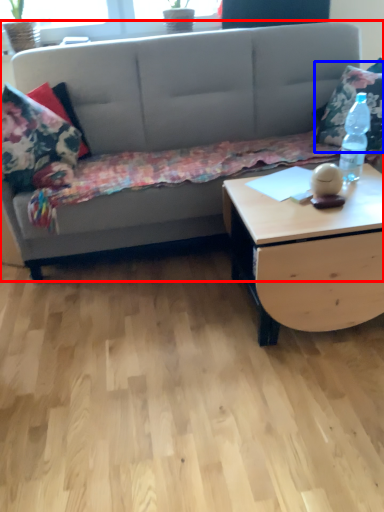
Question: Which point is further to the camera, studio couch (highlighted by a red box) or throw pillow (highlighted by a blue box)?

Choices:
 (A) studio couch
 (B) throw pillow

Answer: (B)